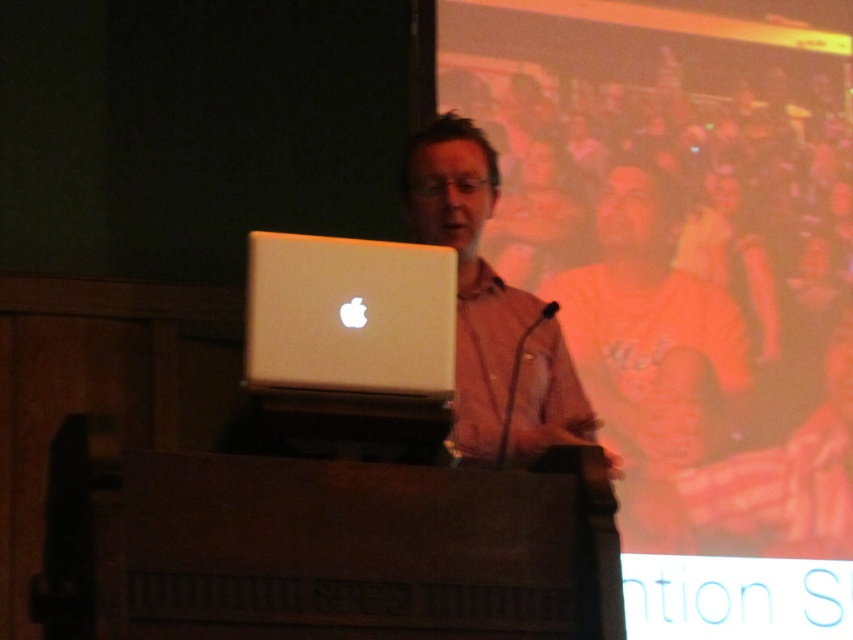
Can you confirm if silver metallic laptop at center is taller than matte white laptop at center?

No, silver metallic laptop at center is not taller than matte white laptop at center.

Is point (396, 305) in front of point (509, 442)?

That is True.

Identify the location of silver metallic laptop at center. Image resolution: width=853 pixels, height=640 pixels. (350, 316).

Where is `silver metallic laptop at center`? This screenshot has width=853, height=640. silver metallic laptop at center is located at coordinates (350, 316).